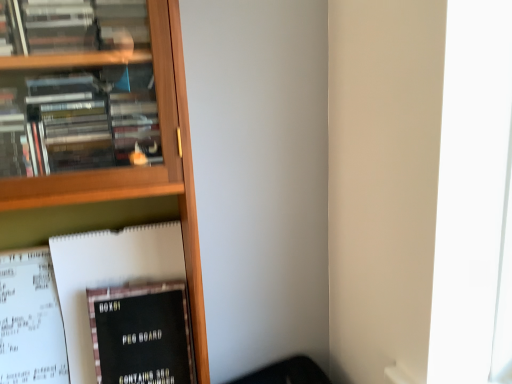
Question: Should I look upward or downward to see black matte peg board at lower left, which is counted as the 2th book, starting from the bottom?

Choices:
 (A) up
 (B) down

Answer: (B)

Question: Considering the relative positions of black matte peg board at lower left, which is counted as the second book, starting from the top, and black matte peg board at lower left, positioned as the 1th book in top-to-bottom order, in the image provided, is black matte peg board at lower left, which is counted as the second book, starting from the top, in front of black matte peg board at lower left, positioned as the 1th book in top-to-bottom order,?

Choices:
 (A) yes
 (B) no

Answer: (A)

Question: From a real-world perspective, is black matte peg board at lower left, which is counted as the second book, starting from the top, on top of black matte peg board at lower left, which is counted as the 2th book, starting from the bottom?

Choices:
 (A) no
 (B) yes

Answer: (A)

Question: From the image's perspective, would you say black matte peg board at lower left, which is counted as the second book, starting from the top, is shown under black matte peg board at lower left, positioned as the 1th book in top-to-bottom order?

Choices:
 (A) yes
 (B) no

Answer: (A)

Question: Considering the relative sizes of black matte peg board at lower left, acting as the 1th book starting from the bottom, and black matte peg board at lower left, which is counted as the 2th book, starting from the bottom, in the image provided, is black matte peg board at lower left, acting as the 1th book starting from the bottom, bigger than black matte peg board at lower left, which is counted as the 2th book, starting from the bottom,?

Choices:
 (A) no
 (B) yes

Answer: (A)

Question: Does black matte peg board at lower left, which is counted as the second book, starting from the top, lie behind black matte peg board at lower left, positioned as the 1th book in top-to-bottom order?

Choices:
 (A) no
 (B) yes

Answer: (A)

Question: Considering the relative sizes of black matte peg board at lower left, which is counted as the second book, starting from the top, and black matte peg board at lower left, positioned as the 1th book in top-to-bottom order, in the image provided, is black matte peg board at lower left, which is counted as the second book, starting from the top, wider than black matte peg board at lower left, positioned as the 1th book in top-to-bottom order,?

Choices:
 (A) no
 (B) yes

Answer: (A)

Question: Is black matte peg board at lower left, which is counted as the 2th book, starting from the bottom, in front of black matte peg board at lower left, which is counted as the second book, starting from the top?

Choices:
 (A) no
 (B) yes

Answer: (A)

Question: From a real-world perspective, is black matte peg board at lower left, positioned as the 1th book in top-to-bottom order, located beneath black matte peg board at lower left, acting as the 1th book starting from the bottom?

Choices:
 (A) yes
 (B) no

Answer: (B)

Question: Would you say black matte peg board at lower left, which is counted as the second book, starting from the top, is part of black matte peg board at lower left, positioned as the 1th book in top-to-bottom order,'s contents?

Choices:
 (A) no
 (B) yes

Answer: (B)

Question: Is black matte peg board at lower left, positioned as the 1th book in top-to-bottom order, to the left of black matte peg board at lower left, acting as the 1th book starting from the bottom, from the viewer's perspective?

Choices:
 (A) yes
 (B) no

Answer: (A)

Question: Does black matte peg board at lower left, positioned as the 1th book in top-to-bottom order, have a greater width compared to black matte peg board at lower left, which is counted as the second book, starting from the top?

Choices:
 (A) yes
 (B) no

Answer: (A)

Question: Considering the relative positions of black matte peg board at lower left, which is counted as the 2th book, starting from the bottom, and black matte peg board at lower left, which is counted as the second book, starting from the top, in the image provided, is black matte peg board at lower left, which is counted as the 2th book, starting from the bottom, to the right of black matte peg board at lower left, which is counted as the second book, starting from the top, from the viewer's perspective?

Choices:
 (A) yes
 (B) no

Answer: (B)

Question: From a real-world perspective, is black matte peg board at lower left, which is counted as the 2th book, starting from the bottom, positioned above or below black matte peg board at lower left, acting as the 1th book starting from the bottom?

Choices:
 (A) above
 (B) below

Answer: (A)